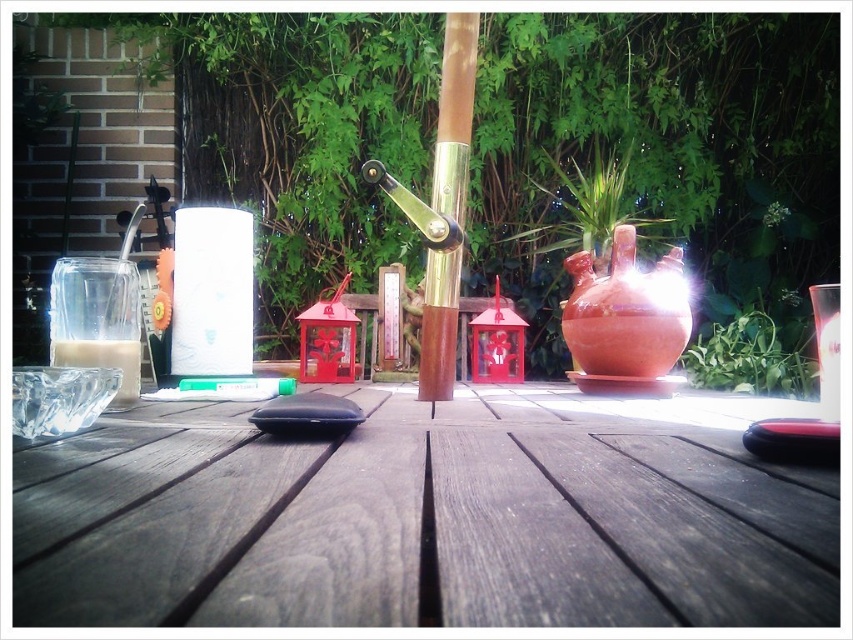
You are a gardener who wants to place a new plant on the dark wood table at center. However, there is already a matte terracotta pot at center on the table. Can you place the new plant there without moving the existing pot?

The dark wood table at center is below the matte terracotta pot at center, so the pot is already occupying the space on the table. Therefore, you cannot place the new plant there without moving the existing pot.

You are setting up a small garden display and need to place a decorative item between the dark wood table at center and the green leafy plant at lower right. Based on their positions, which object should you place the item closer to?

The dark wood table at center is positioned on the left side of the green leafy plant at lower right, so you should place the decorative item closer to the dark wood table at center since it is to the left of the plant.